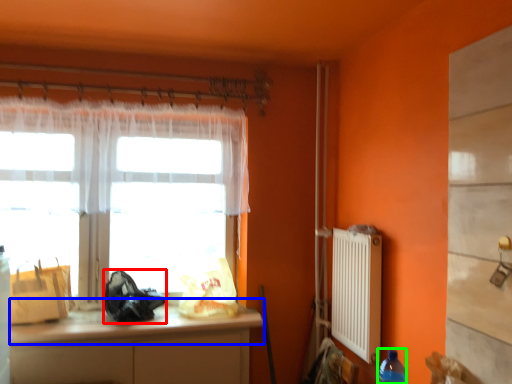
Question: Which is farther away from bag (highlighted by a red box)? counter top (highlighted by a blue box) or bottle (highlighted by a green box)?

Choices:
 (A) counter top
 (B) bottle

Answer: (B)